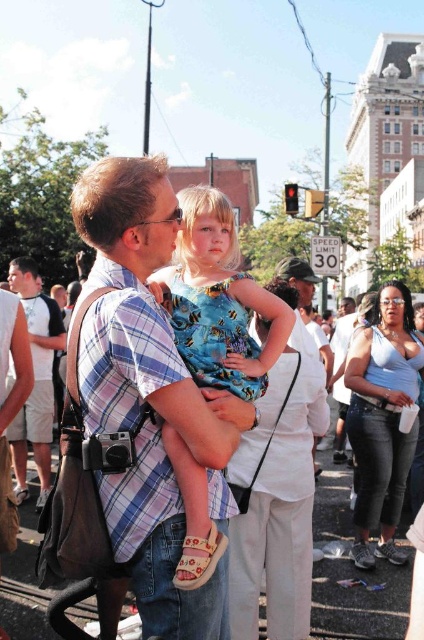
How much distance is there between plaid shirt at center and light brown plaid shirt at center?

20.23 meters

Between point (175, 202) and point (22, 305), which one is positioned in front?

Point (175, 202) is more forward.

Image resolution: width=424 pixels, height=640 pixels. What are the coordinates of `plaid shirt at center` in the screenshot? It's located at (142, 321).

Who is more forward, (x=233, y=305) or (x=30, y=326)?

Point (x=233, y=305) is more forward.

Is blue printed dress at center thinner than light brown plaid shirt at center?

Incorrect, blue printed dress at center's width is not less than light brown plaid shirt at center's.

Looking at this image, measure the distance between blue printed dress at center and camera.

A distance of 53.18 meters exists between blue printed dress at center and camera.

You are a GUI agent. You are given a task and a screenshot of the screen. Output one action in this format:
    pyautogui.click(x=<x>, y=<y>)
    Task: Click on the blue printed dress at center
    
    Given the screenshot: What is the action you would take?
    [x=219, y=300]

Does point (356, 515) come closer to viewer compared to point (50, 472)?

Yes, point (356, 515) is closer to viewer.

In the scene shown: Can you confirm if matte blue tank top at center is shorter than light brown plaid shirt at center?

In fact, matte blue tank top at center may be taller than light brown plaid shirt at center.

The width and height of the screenshot is (424, 640). What do you see at coordinates (382, 419) in the screenshot? I see `matte blue tank top at center` at bounding box center [382, 419].

The height and width of the screenshot is (640, 424). I want to click on matte blue tank top at center, so click(x=382, y=419).